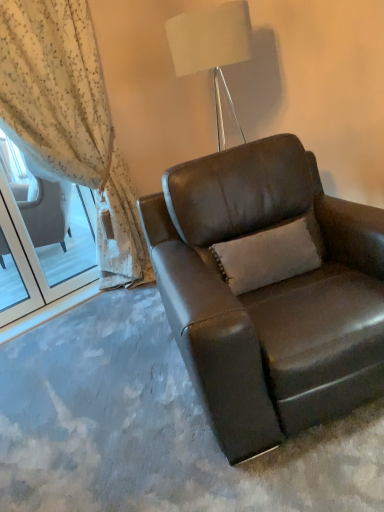
Question: Is brown leather chair at center aimed at white fabric lampshade at upper center?

Choices:
 (A) yes
 (B) no

Answer: (B)

Question: Is brown leather chair at center at the left side of white fabric lampshade at upper center?

Choices:
 (A) yes
 (B) no

Answer: (B)

Question: Is brown leather chair at center far from white fabric lampshade at upper center?

Choices:
 (A) yes
 (B) no

Answer: (B)

Question: Is brown leather chair at center turned away from white fabric lampshade at upper center?

Choices:
 (A) yes
 (B) no

Answer: (B)

Question: Would you say brown leather chair at center is outside white fabric lampshade at upper center?

Choices:
 (A) no
 (B) yes

Answer: (B)

Question: Visually, is white fabric lampshade at upper center positioned to the left or to the right of brown leather chair at center?

Choices:
 (A) right
 (B) left

Answer: (B)

Question: In terms of height, does white fabric lampshade at upper center look taller or shorter compared to brown leather chair at center?

Choices:
 (A) short
 (B) tall

Answer: (A)

Question: From the image's perspective, is white fabric lampshade at upper center positioned above or below brown leather chair at center?

Choices:
 (A) above
 (B) below

Answer: (A)

Question: From a real-world perspective, is white fabric lampshade at upper center physically located above or below brown leather chair at center?

Choices:
 (A) above
 (B) below

Answer: (A)

Question: Do you think brown leather chair at center is within sheer floral fabric at left, or outside of it?

Choices:
 (A) outside
 (B) inside

Answer: (A)

Question: From the image's perspective, is brown leather chair at center above or below sheer floral fabric at left?

Choices:
 (A) above
 (B) below

Answer: (B)

Question: Is brown leather chair at center wider or thinner than sheer floral fabric at left?

Choices:
 (A) thin
 (B) wide

Answer: (B)

Question: From a real-world perspective, is brown leather chair at center above or below sheer floral fabric at left?

Choices:
 (A) below
 (B) above

Answer: (A)

Question: Is white fabric lampshade at upper center inside or outside of sheer floral fabric at left?

Choices:
 (A) outside
 (B) inside

Answer: (A)

Question: From their relative heights in the image, would you say white fabric lampshade at upper center is taller or shorter than sheer floral fabric at left?

Choices:
 (A) tall
 (B) short

Answer: (B)